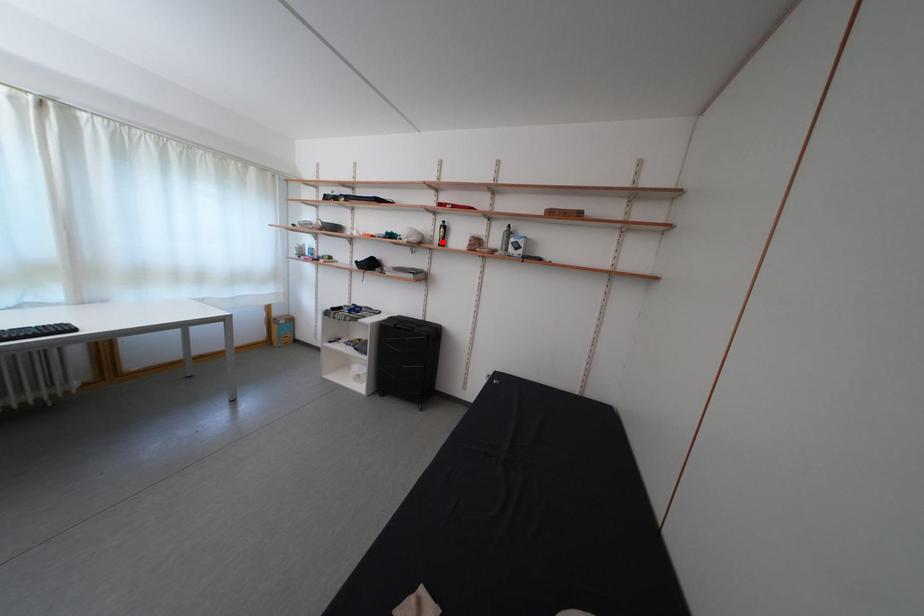
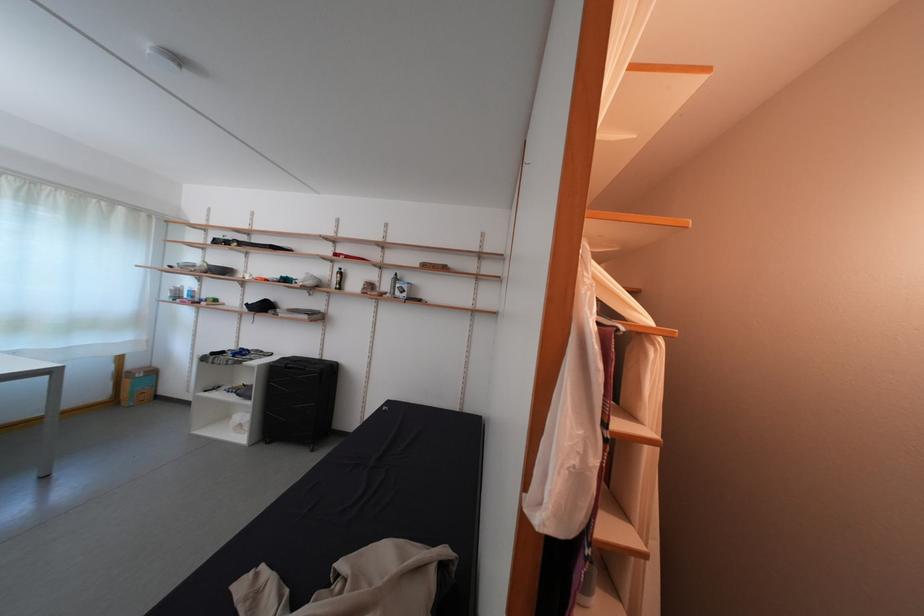
Question: I am providing you with two images of the same scene from different viewpoints. A red point is marked on the first image. Is the red point's position out of view in image 2?

Choices:
 (A) Yes
 (B) No

Answer: (B)